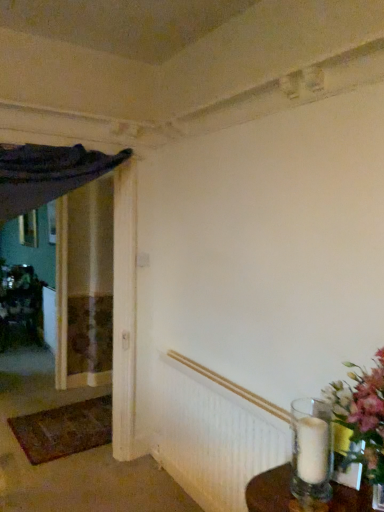
The image size is (384, 512). Describe the element at coordinates (311, 450) in the screenshot. I see `clear glass vase at lower right` at that location.

Image resolution: width=384 pixels, height=512 pixels. Describe the element at coordinates (64, 429) in the screenshot. I see `brown woven mat at lower left` at that location.

What do you see at coordinates (20, 303) in the screenshot?
I see `metallic silver vase at left` at bounding box center [20, 303].

Image resolution: width=384 pixels, height=512 pixels. Find the location of `clear glass vase at lower right`. clear glass vase at lower right is located at coordinates click(311, 450).

Are wooden picture frame at left and clear glass vase at lower right located far from each other?

Yes.

Does point (21, 232) come closer to viewer compared to point (323, 469)?

That is False.

In terms of size, does wooden picture frame at left appear bigger or smaller than clear glass vase at lower right?

Clearly, wooden picture frame at left is larger in size than clear glass vase at lower right.

Where is `doormat located on the right of metallic silver vase at left`? Image resolution: width=384 pixels, height=512 pixels. doormat located on the right of metallic silver vase at left is located at coordinates 64,429.

Would you say metallic silver vase at left is outside brown woven mat at lower left?

Indeed, metallic silver vase at left is completely outside brown woven mat at lower left.

Visually, is metallic silver vase at left positioned to the left or to the right of brown woven mat at lower left?

metallic silver vase at left is positioned on brown woven mat at lower left's left side.

Who is more distant, metallic silver vase at left or brown woven mat at lower left?

metallic silver vase at left is more distant.

Between point (90, 443) and point (302, 406), which one is positioned behind?

Point (90, 443)

From a real-world perspective, is brown woven mat at lower left below clear glass vase at lower right?

Yes, from a real-world perspective, brown woven mat at lower left is below clear glass vase at lower right.

Considering the relative positions of brown woven mat at lower left and clear glass vase at lower right in the image provided, is brown woven mat at lower left in front of clear glass vase at lower right?

No, it is behind clear glass vase at lower right.

From the image's perspective, which one is positioned lower, white textured radiator at lower right or wooden picture frame at left?

white textured radiator at lower right, from the image's perspective.

Is white textured radiator at lower right positioned before wooden picture frame at left?

Yes, white textured radiator at lower right is closer to the viewer.

Is point (195, 402) positioned in front of point (35, 245)?

Yes, point (195, 402) is closer to viewer.

From the image's perspective, does metallic silver vase at left appear lower than white textured radiator at lower right?

No, from the image's perspective, metallic silver vase at left is not below white textured radiator at lower right.

Is metallic silver vase at left thinner than white textured radiator at lower right?

No, metallic silver vase at left is not thinner than white textured radiator at lower right.

Is white textured radiator at lower right located within metallic silver vase at left?

No, white textured radiator at lower right is not a part of metallic silver vase at left.

Considering the relative sizes of metallic silver vase at left and white textured radiator at lower right in the image provided, is metallic silver vase at left taller than white textured radiator at lower right?

Yes, metallic silver vase at left is taller than white textured radiator at lower right.

Is brown woven mat at lower left at the back of clear glass vase at lower right?

No, clear glass vase at lower right is not facing away from brown woven mat at lower left.

Does clear glass vase at lower right have a lesser width compared to brown woven mat at lower left?

Indeed, clear glass vase at lower right has a lesser width compared to brown woven mat at lower left.

Is clear glass vase at lower right surrounding brown woven mat at lower left?

Definitely not — brown woven mat at lower left is not inside clear glass vase at lower right.

From a real-world perspective, does clear glass vase at lower right sit lower than brown woven mat at lower left?

Actually, clear glass vase at lower right is physically above brown woven mat at lower left in the real world.

Is metallic silver vase at left oriented away from wooden picture frame at left?

No, metallic silver vase at left's orientation is not away from wooden picture frame at left.

From the image's perspective, is metallic silver vase at left under wooden picture frame at left?

Yes.

From the picture: Is metallic silver vase at left positioned beyond the bounds of wooden picture frame at left?

That's correct, metallic silver vase at left is outside of wooden picture frame at left.

Between metallic silver vase at left and wooden picture frame at left, which one appears on the left side from the viewer's perspective?

Positioned to the left is wooden picture frame at left.

The height and width of the screenshot is (512, 384). In order to click on candle holder that appears on the right of wooden picture frame at left in this screenshot , I will do `click(311, 450)`.

Find the location of a particular element. This screenshot has width=384, height=512. furniture above the brown woven mat at lower left (from a real-world perspective) is located at coordinates (20, 303).

Which object lies further to the anchor point white textured radiator at lower right, metallic silver vase at left or clear glass vase at lower right?

Among the two, metallic silver vase at left is located further to white textured radiator at lower right.

When comparing their distances from white textured radiator at lower right, does metallic silver vase at left or brown woven mat at lower left seem closer?

brown woven mat at lower left is closer to white textured radiator at lower right.

Looking at the image, which one is located closer to clear glass vase at lower right, white textured radiator at lower right or wooden picture frame at left?

Based on the image, white textured radiator at lower right appears to be nearer to clear glass vase at lower right.

Estimate the real-world distances between objects in this image. Which object is closer to brown woven mat at lower left, wooden picture frame at left or white textured radiator at lower right?

white textured radiator at lower right is closer to brown woven mat at lower left.

Estimate the real-world distances between objects in this image. Which object is further from white textured radiator at lower right, wooden picture frame at left or brown woven mat at lower left?

The object further to white textured radiator at lower right is wooden picture frame at left.

Looking at the image, which one is located closer to metallic silver vase at left, white textured radiator at lower right or brown woven mat at lower left?

brown woven mat at lower left.

Which object lies further to the anchor point white textured radiator at lower right, brown woven mat at lower left or clear glass vase at lower right?

The object further to white textured radiator at lower right is brown woven mat at lower left.

Looking at the image, which one is located closer to white textured radiator at lower right, wooden picture frame at left or metallic silver vase at left?

Among the two, metallic silver vase at left is located nearer to white textured radiator at lower right.

Where is `doormat located between clear glass vase at lower right and metallic silver vase at left in the depth direction`? Image resolution: width=384 pixels, height=512 pixels. doormat located between clear glass vase at lower right and metallic silver vase at left in the depth direction is located at coordinates (64, 429).

The height and width of the screenshot is (512, 384). I want to click on doormat between white textured radiator at lower right and wooden picture frame at left in the front-back direction, so click(x=64, y=429).

Locate an element on the screen. furniture between brown woven mat at lower left and wooden picture frame at left along the z-axis is located at coordinates (20, 303).

At what (x,y) coordinates should I click in order to perform the action: click on radiator positioned between clear glass vase at lower right and brown woven mat at lower left from near to far. Please return your answer as a coordinate pair (x, y). Looking at the image, I should click on tap(215, 433).